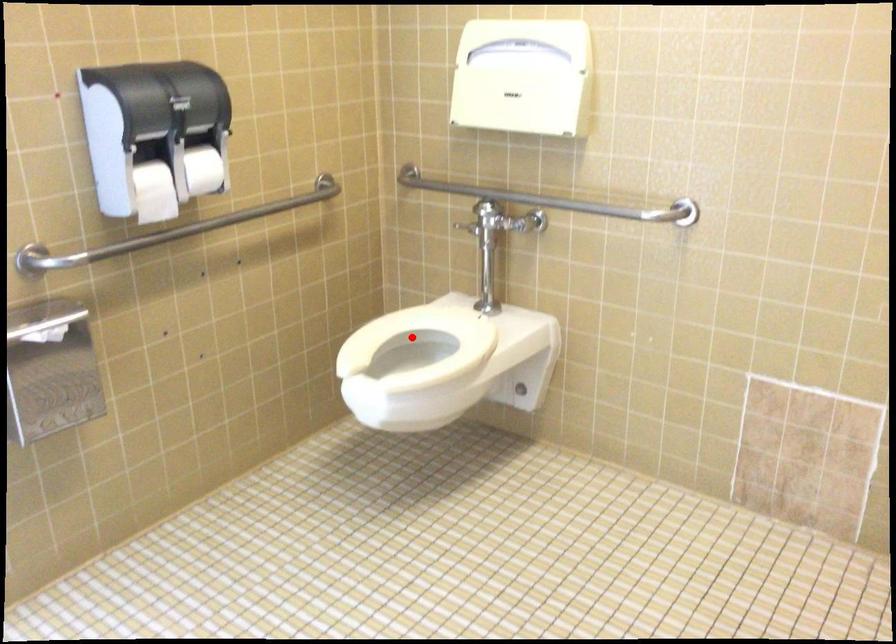
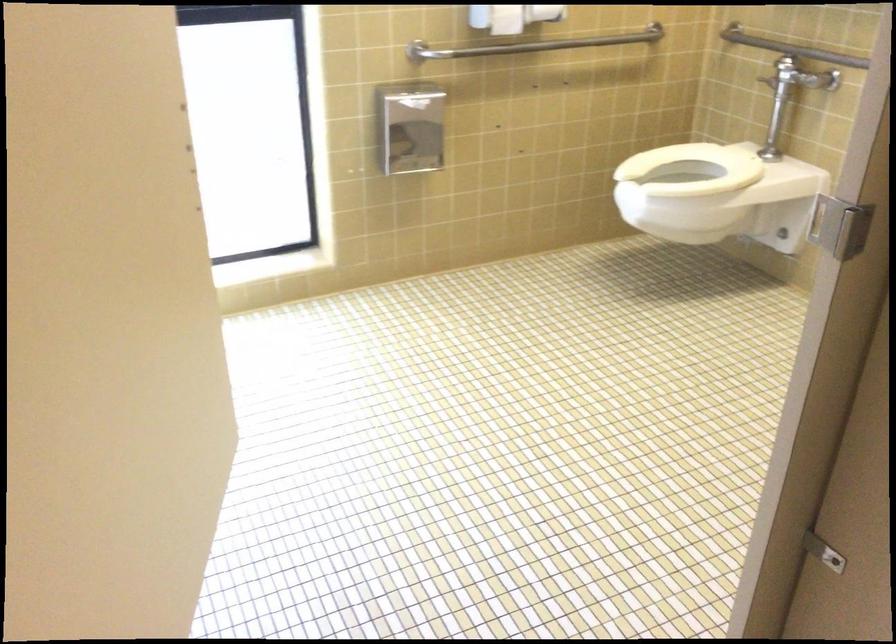
Question: I am providing you with two images of the same scene from different viewpoints. Image1 has a red point marked. In image2, the corresponding 3D location appears at what relative position? Reply with the corresponding letter.

Choices:
 (A) Closer
 (B) Farther

Answer: (B)